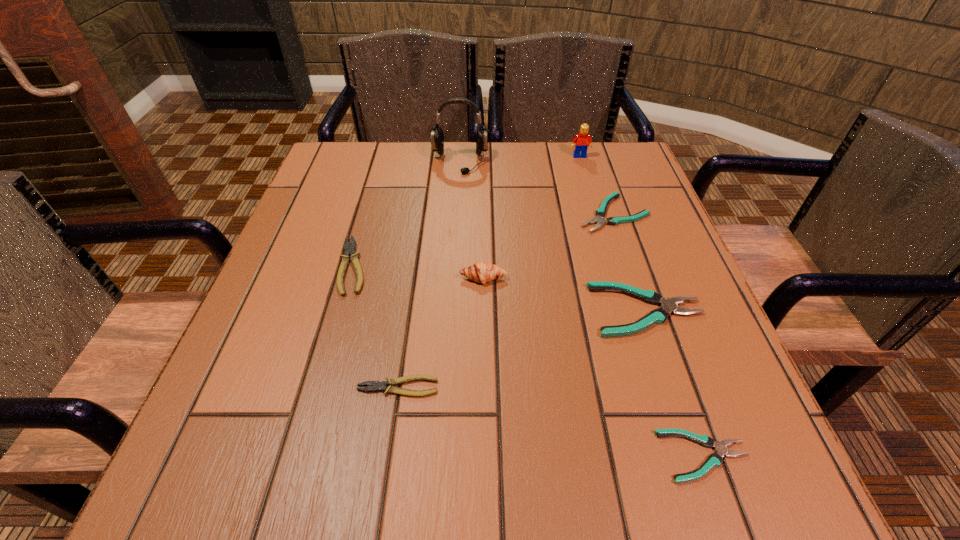
The width and height of the screenshot is (960, 540). I want to click on the right yellow pliers, so click(x=377, y=386).

Find the location of a particular element. This screenshot has height=540, width=960. the nearest teal pliers is located at coordinates (714, 460).

Image resolution: width=960 pixels, height=540 pixels. I want to click on the shortest pliers, so click(x=714, y=460).

This screenshot has height=540, width=960. In order to click on vacant area situated 0.400m with the microphone on the side of the headset in this screenshot , I will do `click(452, 293)`.

This screenshot has height=540, width=960. Find the location of `free location located on the front-facing side of the Lego`. free location located on the front-facing side of the Lego is located at coordinates (585, 173).

Locate an element on the screen. free space located on the front-facing side of the pastry is located at coordinates (484, 352).

You are a GUI agent. You are given a task and a screenshot of the screen. Output one action in this format:
    pyautogui.click(x=<x>, y=<y>)
    Task: Click on the vacant space situated on the back of the second farthest teal pliers
    
    Given the screenshot: What is the action you would take?
    pyautogui.click(x=619, y=229)

In order to click on blank space located on the right of the farther yellow pliers in this screenshot , I will do `click(443, 266)`.

This screenshot has height=540, width=960. I want to click on blank area located 0.060m on the front of the second biggest teal pliers, so click(x=626, y=253).

Find the location of `vacant space situated on the right of the nearer yellow pliers`. vacant space situated on the right of the nearer yellow pliers is located at coordinates (557, 387).